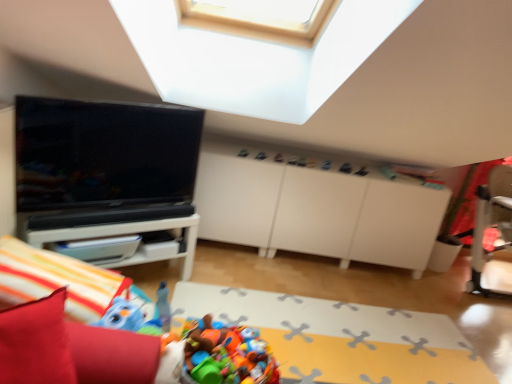
At what (x,y) coordinates should I click in order to perform the action: click on free space below matte black tv at left (from a real-world perspective). Please return your answer as a coordinate pair (x, y). Looking at the image, I should click on (130, 206).